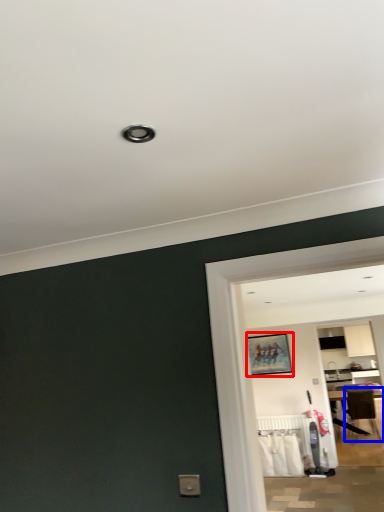
Question: Which object appears closest to the camera in this image, picture frame (highlighted by a red box) or chair (highlighted by a blue box)?

Choices:
 (A) picture frame
 (B) chair

Answer: (A)